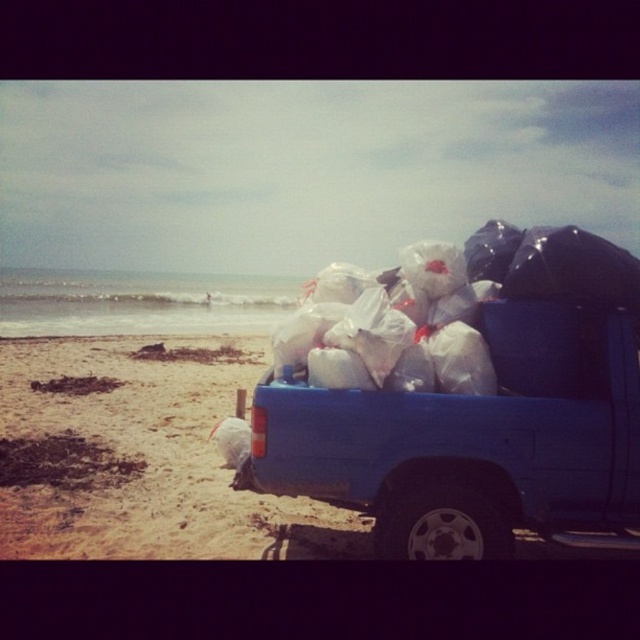
Is blue matte truck at right closer to camera compared to white plastic bags at center?

Yes.

The width and height of the screenshot is (640, 640). What are the coordinates of `blue matte truck at right` in the screenshot? It's located at (474, 442).

Which is behind, point (620, 435) or point (605, 305)?

The point (605, 305) is behind.

Locate an element on the screen. The width and height of the screenshot is (640, 640). blue matte truck at right is located at coordinates pyautogui.click(x=474, y=442).